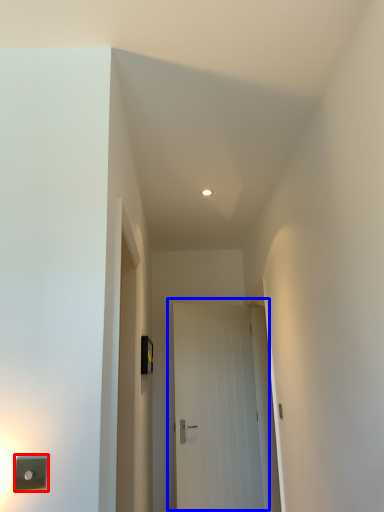
Question: Which object appears farthest to the camera in this image, light switch (highlighted by a red box) or door (highlighted by a blue box)?

Choices:
 (A) light switch
 (B) door

Answer: (B)